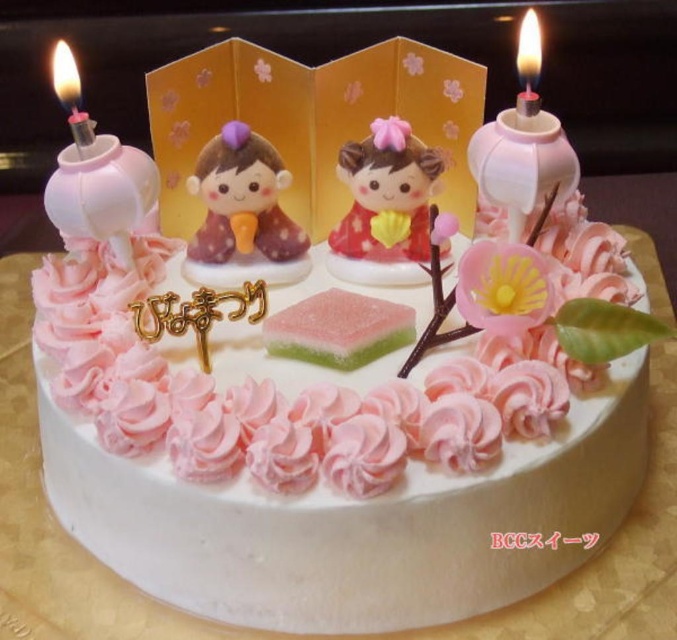
Between matte pink clay doll at center and translucent glass candle at upper right, which one has less height?

Standing shorter between the two is translucent glass candle at upper right.

Who is more distant from viewer, (359, 179) or (536, 28)?

Point (359, 179)

Is point (395, 131) closer to viewer compared to point (523, 20)?

That is True.

Where is `matte pink clay doll at center`? The width and height of the screenshot is (677, 640). matte pink clay doll at center is located at coordinates (387, 192).

Is translucent white candle at left taller than translucent glass candle at upper right?

In fact, translucent white candle at left may be shorter than translucent glass candle at upper right.

Which is below, translucent white candle at left or translucent glass candle at upper right?

translucent white candle at left is below.

In order to click on translucent white candle at left in this screenshot , I will do `click(70, 93)`.

Does matte brown figurine at center appear under translucent white candle at left?

Yes.

Who is positioned more to the left, matte brown figurine at center or translucent white candle at left?

Positioned to the left is translucent white candle at left.

Where is `matte brown figurine at center`? matte brown figurine at center is located at coordinates (242, 200).

Find the location of `matte brown figurine at center`. matte brown figurine at center is located at coordinates (242, 200).